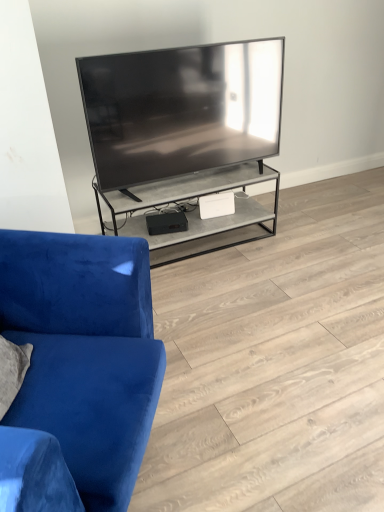
The image size is (384, 512). What do you see at coordinates (85, 352) in the screenshot?
I see `velvet blue couch at left` at bounding box center [85, 352].

Identify the location of velvet blue couch at left. The image size is (384, 512). (85, 352).

In order to click on blue velvet couch at left in this screenshot , I will do `click(276, 362)`.

This screenshot has height=512, width=384. What do you see at coordinates (276, 362) in the screenshot?
I see `blue velvet couch at left` at bounding box center [276, 362].

This screenshot has height=512, width=384. In order to click on velvet blue couch at left in this screenshot , I will do `click(85, 352)`.

Looking at this image, in the image, is blue velvet couch at left on the left side or the right side of velvet blue couch at left?

In the image, blue velvet couch at left appears on the right side of velvet blue couch at left.

Looking at this image, which object is more forward, blue velvet couch at left or velvet blue couch at left?

velvet blue couch at left.

Is point (203, 278) positioned behind point (24, 264)?

Yes, point (203, 278) is farther from viewer.

From the image's perspective, is blue velvet couch at left below velvet blue couch at left?

No, from the image's perspective, blue velvet couch at left is not below velvet blue couch at left.

In the scene shown: From a real-world perspective, who is located lower, blue velvet couch at left or velvet blue couch at left?

In real-world perspective, blue velvet couch at left is lower.

Based on the photo, does blue velvet couch at left have a greater width compared to velvet blue couch at left?

Indeed, blue velvet couch at left has a greater width compared to velvet blue couch at left.

From the picture: From their relative heights in the image, would you say blue velvet couch at left is taller or shorter than velvet blue couch at left?

Clearly, blue velvet couch at left is shorter compared to velvet blue couch at left.

Which of these two, blue velvet couch at left or velvet blue couch at left, is smaller?

blue velvet couch at left is smaller.

Is velvet blue couch at left surrounded by blue velvet couch at left?

No, velvet blue couch at left is located outside of blue velvet couch at left.

Is the surface of blue velvet couch at left in direct contact with velvet blue couch at left?

blue velvet couch at left and velvet blue couch at left are not in contact.

Could you tell me if blue velvet couch at left is turned towards velvet blue couch at left?

No, blue velvet couch at left is not oriented towards velvet blue couch at left.

Where is `studio couch on the left of the blue velvet couch at left`? studio couch on the left of the blue velvet couch at left is located at coordinates (85, 352).

Is velvet blue couch at left to the right of blue velvet couch at left from the viewer's perspective?

Incorrect, velvet blue couch at left is not on the right side of blue velvet couch at left.

Considering the relative positions of velvet blue couch at left and blue velvet couch at left in the image provided, is velvet blue couch at left in front of blue velvet couch at left?

Yes, velvet blue couch at left is closer to the camera.

Which is in front, point (114, 385) or point (367, 421)?

The point (114, 385) is more forward.

Based on the photo, from the image's perspective, which is above, velvet blue couch at left or blue velvet couch at left?

blue velvet couch at left is shown above in the image.

From a real-world perspective, which object rests below the other?

In real-world perspective, blue velvet couch at left is lower.

Considering the relative sizes of velvet blue couch at left and blue velvet couch at left in the image provided, is velvet blue couch at left wider than blue velvet couch at left?

No, velvet blue couch at left is not wider than blue velvet couch at left.

Does velvet blue couch at left have a lesser height compared to blue velvet couch at left?

In fact, velvet blue couch at left may be taller than blue velvet couch at left.

Considering the sizes of objects velvet blue couch at left and blue velvet couch at left in the image provided, who is smaller, velvet blue couch at left or blue velvet couch at left?

blue velvet couch at left.

Choose the correct answer: Is velvet blue couch at left inside blue velvet couch at left or outside it?

velvet blue couch at left is spatially situated outside blue velvet couch at left.

Is the surface of velvet blue couch at left in direct contact with blue velvet couch at left?

No, velvet blue couch at left is not making contact with blue velvet couch at left.

Is velvet blue couch at left looking in the opposite direction of blue velvet couch at left?

No.

What are the coordinates of `studio couch that is above the blue velvet couch at left (from a real-world perspective)` in the screenshot? It's located at (85, 352).

I want to click on studio couch below the blue velvet couch at left (from the image's perspective), so click(x=85, y=352).

Find the location of a particular element. The image size is (384, 512). tile that appears above the velvet blue couch at left (from the image's perspective) is located at coordinates (276, 362).